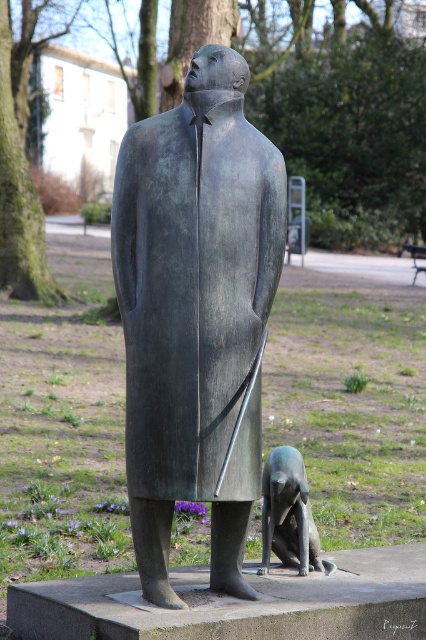
Who is shorter, bronze dog at lower center or wooden park bench at center?

With less height is wooden park bench at center.

Which is more to the left, bronze dog at lower center or wooden park bench at center?

bronze dog at lower center is more to the left.

Which is behind, point (262, 541) or point (417, 244)?

Positioned behind is point (417, 244).

The height and width of the screenshot is (640, 426). Find the location of `bronze dog at lower center`. bronze dog at lower center is located at coordinates click(x=288, y=515).

Between bronze statue at center and wooden park bench at center, which one appears on the left side from the viewer's perspective?

From the viewer's perspective, bronze statue at center appears more on the left side.

Can you confirm if bronze statue at center is bigger than wooden park bench at center?

Indeed, bronze statue at center has a larger size compared to wooden park bench at center.

Locate an element on the screen. bronze statue at center is located at coordinates (195, 310).

Where is `bronze statue at center`? bronze statue at center is located at coordinates (195, 310).

From the picture: Can you confirm if bronze statue at center is positioned below bronze dog at lower center?

No, bronze statue at center is not below bronze dog at lower center.

Is point (255, 317) farther from camera compared to point (273, 528)?

No.

Who is more distant from viewer, (224,356) or (302,496)?

Positioned behind is point (302,496).

The image size is (426, 640). I want to click on bronze statue at center, so click(195, 310).